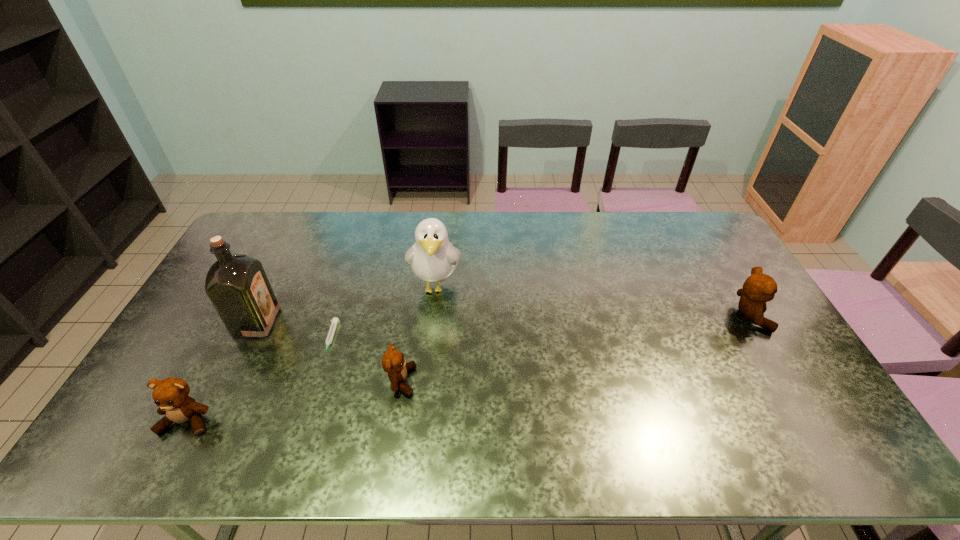
You are a GUI agent. You are given a task and a screenshot of the screen. Output one action in this format:
    pyautogui.click(x=<x>, y=<y>)
    Task: Click on the vacant space at the left edge of the desktop
    The height and width of the screenshot is (540, 960).
    Given the screenshot: What is the action you would take?
    pyautogui.click(x=265, y=268)

Where is `vacant space at the far left corner`? vacant space at the far left corner is located at coordinates (253, 244).

The width and height of the screenshot is (960, 540). I want to click on vacant point at the near right corner, so click(x=784, y=411).

The width and height of the screenshot is (960, 540). Find the location of `free point between the shortest object and the third shortest object`. free point between the shortest object and the third shortest object is located at coordinates (259, 380).

Identify the location of free space that is in between the gull and the liquor. (347, 304).

At what (x,y) coordinates should I click in order to perform the action: click on vacant area that lies between the liquor and the rightmost teddy bear. Please return your answer as a coordinate pair (x, y). Looking at the image, I should click on (503, 319).

The width and height of the screenshot is (960, 540). I want to click on free space between the shortest object and the liquor, so click(x=294, y=330).

Where is `empty space that is in between the liquor and the syringe`? empty space that is in between the liquor and the syringe is located at coordinates (294, 330).

This screenshot has width=960, height=540. In order to click on free space between the rightmost object and the liquor in this screenshot , I will do `click(503, 319)`.

The image size is (960, 540). I want to click on free space between the fifth shortest object and the syringe, so click(383, 313).